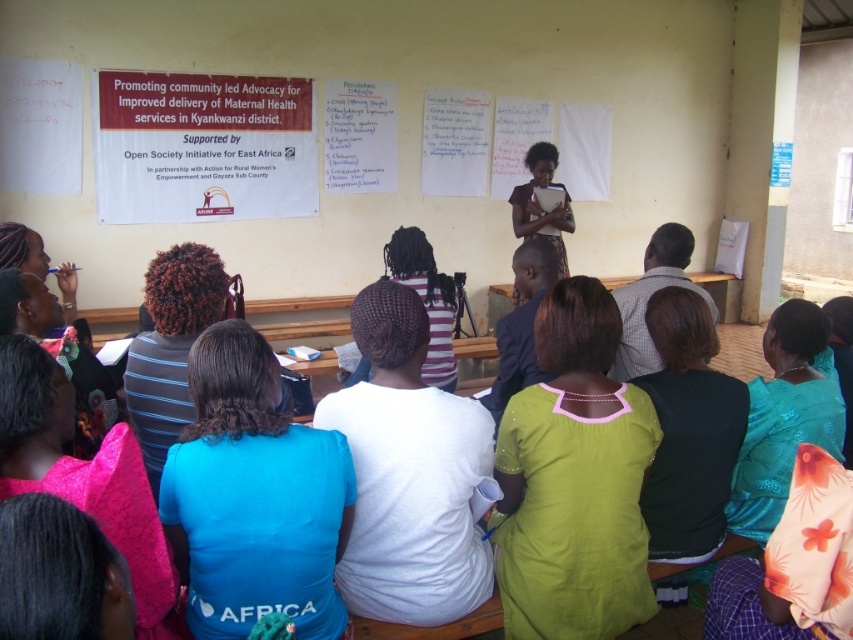
In the scene shown: You are a photographer standing at the back of the room. You want to capture a photo that includes both the blue fabric shirt at center and the teal satin dress at lower right. Given that your camera has a maximum focus range of 5 feet, will you be able to get both subjects in focus at the same time?

The blue fabric shirt at center is 5.22 feet from the teal satin dress at lower right. Since the distance between them exceeds the camera maximum focus range of 5 feet, you won

You are a photographer in the back of the room and want to take a photo of the blue fabric shirt at center and the teal satin dress at lower right. Which clothing item will have its lower hem visible in the photo?

The blue fabric shirt at center is shorter than the teal satin dress at lower right, so the lower hem of the blue fabric shirt at center will be visible in the photo.

What is the relationship between the thickness of the dark brown curly hair at center and the checkered fabric shirt at center?

The dark brown curly hair at center is thinner than the checkered fabric shirt at center.